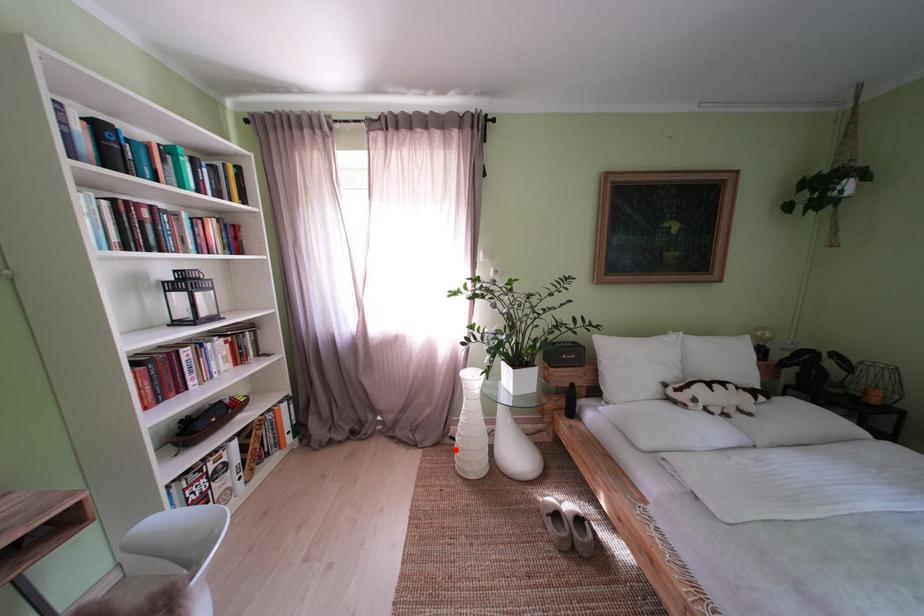
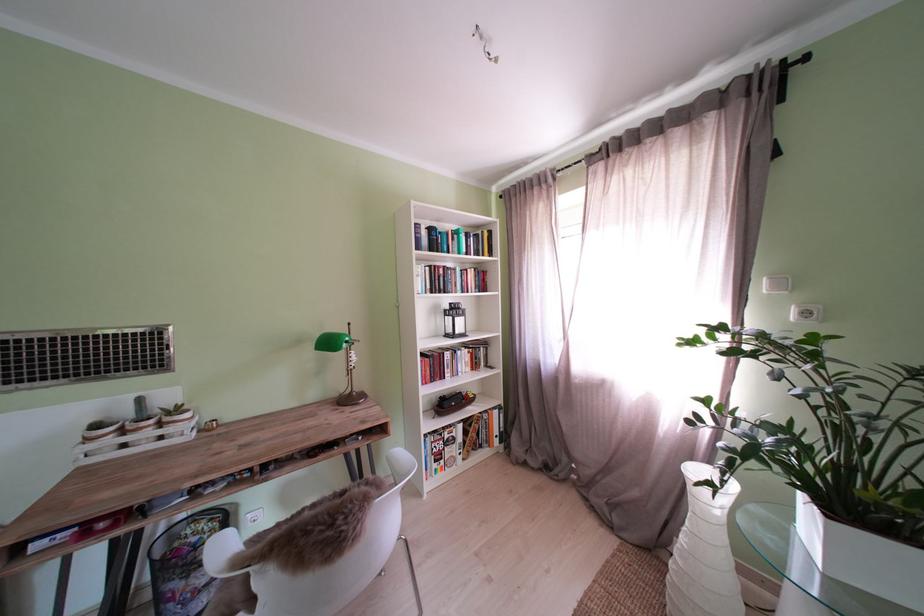
The point at the highlighted location is marked in the first image. Where is the corresponding point in the second image?

(670, 564)